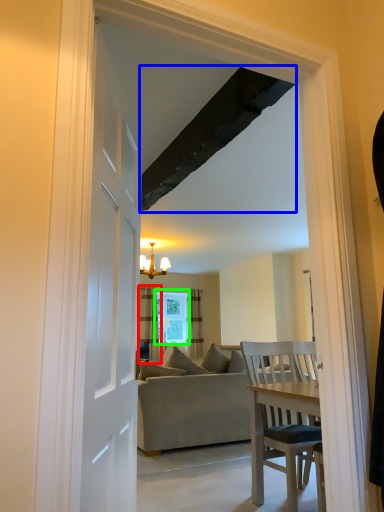
Question: Based on their relative distances, which object is farther from curtain (highlighted by a red box)? Choose from exhaust hood (highlighted by a blue box) and window (highlighted by a green box).

Choices:
 (A) exhaust hood
 (B) window

Answer: (A)